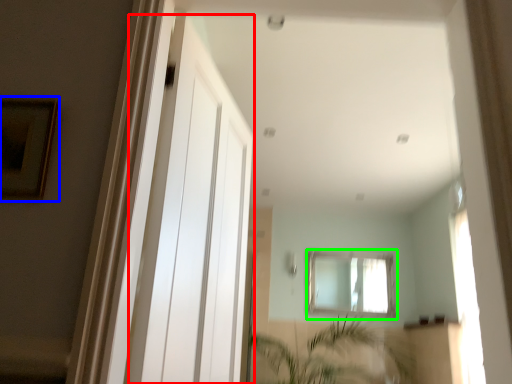
Question: Which object is the closest to the screen door (highlighted by a red box)? Choose among these: picture frame (highlighted by a blue box) or window (highlighted by a green box).

Choices:
 (A) picture frame
 (B) window

Answer: (A)